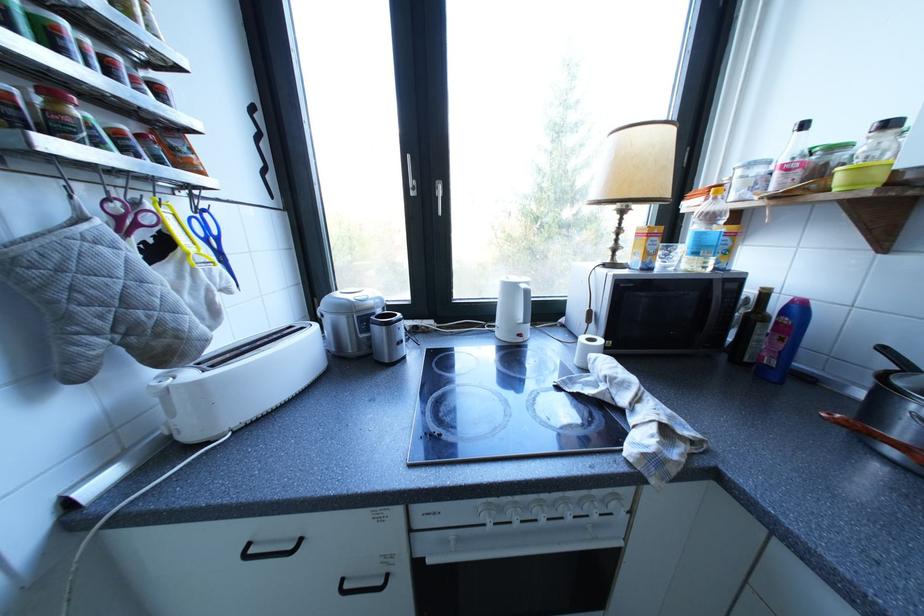
Locate an element on the screen. The height and width of the screenshot is (616, 924). white kettle handle is located at coordinates (238, 382).